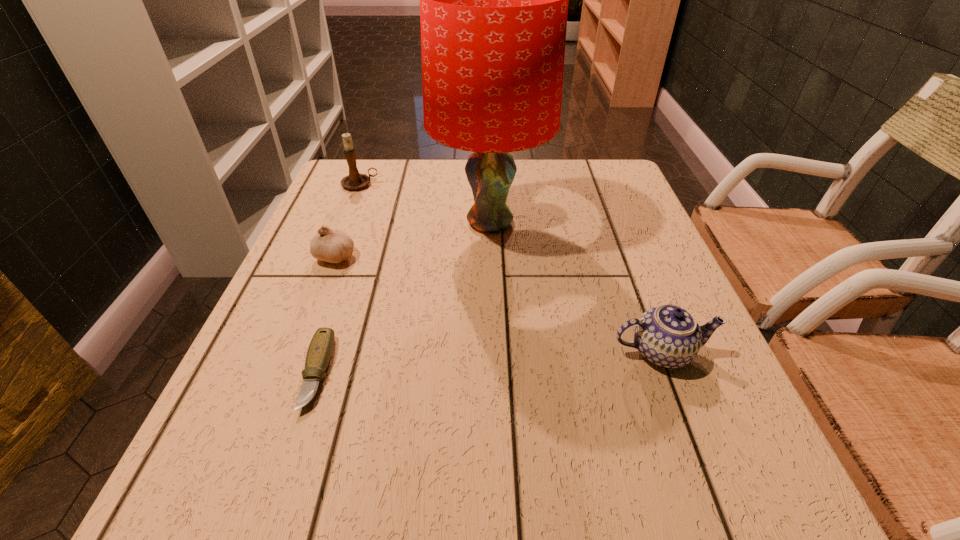
Where is `vacant space that's between the second shortest object and the rightmost object`? The image size is (960, 540). vacant space that's between the second shortest object and the rightmost object is located at coordinates (498, 304).

I want to click on free space between the candle holder and the shortest object, so click(339, 279).

This screenshot has height=540, width=960. Find the location of `free area in between the tallest object and the fourth tallest object`. free area in between the tallest object and the fourth tallest object is located at coordinates (413, 239).

Identify the location of vacant space that is in between the garlic and the shortest object. (326, 314).

Locate an element on the screen. vacant space that's between the lampshade and the garlic is located at coordinates (413, 239).

You are a GUI agent. You are given a task and a screenshot of the screen. Output one action in this format:
    pyautogui.click(x=<x>, y=<y>)
    Task: Click on the object that is the third nearest to the rightmost object
    
    Given the screenshot: What is the action you would take?
    pyautogui.click(x=334, y=246)

Identify the location of object that is the second closest one to the fourth shortest object. The image size is (960, 540). (334, 246).

Where is `free space in the image that satisfies the following two spatial constraints: 1. on the front side of the pocketknife; 2. on the right side of the garlic`? This screenshot has height=540, width=960. free space in the image that satisfies the following two spatial constraints: 1. on the front side of the pocketknife; 2. on the right side of the garlic is located at coordinates (291, 373).

At what (x,y) coordinates should I click in order to perform the action: click on vacant space that satisfies the following two spatial constraints: 1. on the side of the shortest object with the handle; 2. on the left side of the candle holder. Please return your answer as a coordinate pair (x, y). This screenshot has width=960, height=540. Looking at the image, I should click on (286, 373).

Locate an element on the screen. Image resolution: width=960 pixels, height=540 pixels. vacant region that satisfies the following two spatial constraints: 1. on the side of the garlic with the handle; 2. on the right side of the candle holder is located at coordinates (332, 256).